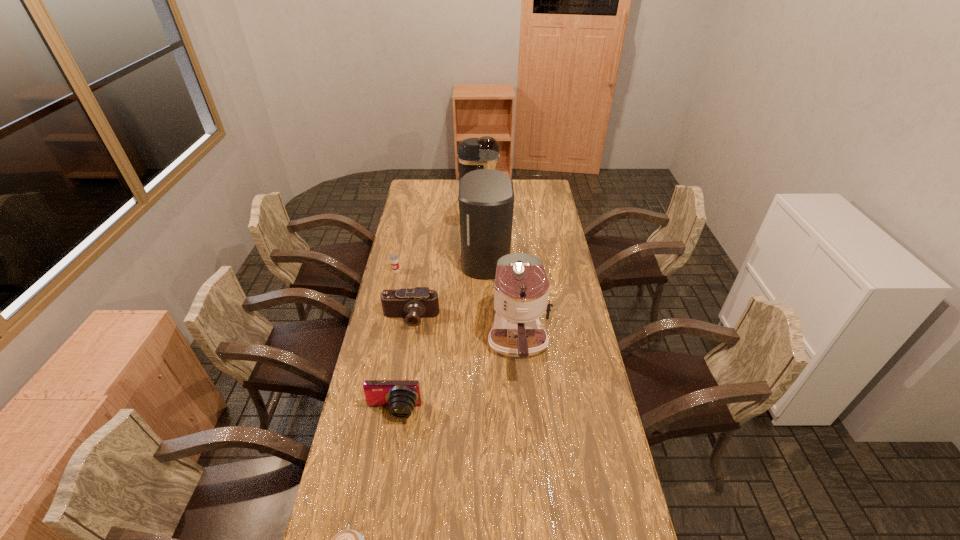
Where is `vacant region located 0.350m on the front-facing side of the nearest coffee maker`? vacant region located 0.350m on the front-facing side of the nearest coffee maker is located at coordinates (530, 483).

Locate an element on the screen. The height and width of the screenshot is (540, 960). free region located on the front-facing side of the farther camera is located at coordinates click(x=402, y=370).

The height and width of the screenshot is (540, 960). I want to click on free location located 0.320m on the front-facing side of the sixth farthest object, so click(373, 530).

The width and height of the screenshot is (960, 540). What are the coordinates of `free spot located on the side of the cup with the logo` in the screenshot? It's located at (383, 330).

The image size is (960, 540). Identify the location of object located in the far edge section of the desktop. (473, 153).

Where is `cup present at the left edge`? cup present at the left edge is located at coordinates (394, 259).

The image size is (960, 540). I want to click on object that is positioned at the right edge, so click(x=521, y=291).

Locate an element on the screen. The height and width of the screenshot is (540, 960). free point at the left edge is located at coordinates (405, 232).

Where is `vacant region at the right edge of the desktop`? This screenshot has width=960, height=540. vacant region at the right edge of the desktop is located at coordinates (567, 440).

In the image, there is a desktop. Where is `vacant space at the far left corner`? vacant space at the far left corner is located at coordinates (436, 181).